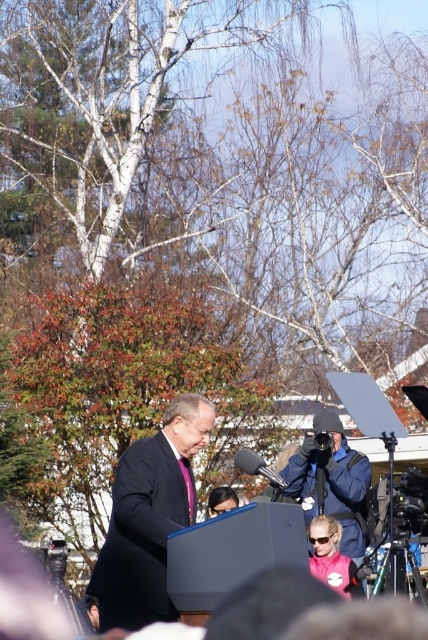
Who is higher up, matte black suit at center or matte black camera at center?

Positioned higher is matte black suit at center.

Is matte black suit at center shorter than matte black camera at center?

In fact, matte black suit at center may be taller than matte black camera at center.

Is point (205, 401) positioned after point (359, 492)?

No.

This screenshot has height=640, width=428. In order to click on matte black suit at center in this screenshot , I will do `click(148, 516)`.